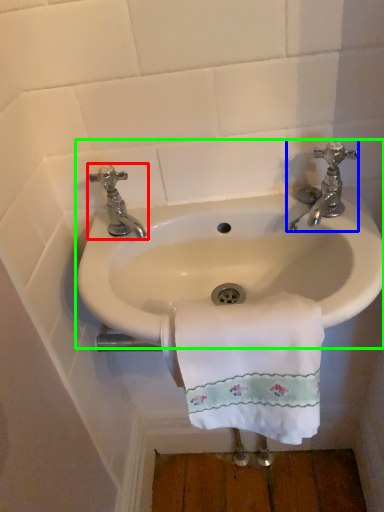
Question: Based on their relative distances, which object is nearer to tap (highlighted by a red box)? Choose from tap (highlighted by a blue box) and sink (highlighted by a green box).

Choices:
 (A) tap
 (B) sink

Answer: (B)